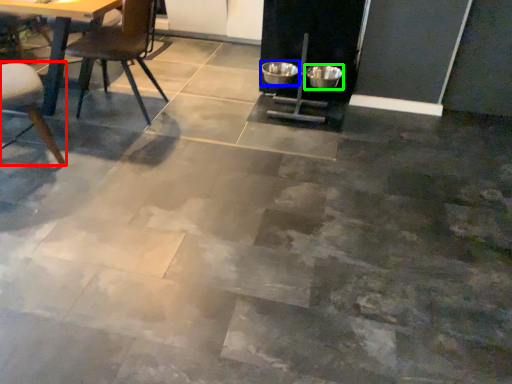
Question: Which object is the farthest from chair (highlighted by a red box)? Choose among these: bowl (highlighted by a blue box) or bowl (highlighted by a green box).

Choices:
 (A) bowl
 (B) bowl

Answer: (B)